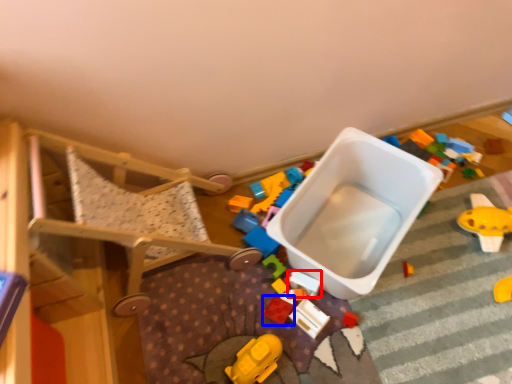
Question: Which point is closer to the camera, toy (highlighted by a red box) or toy (highlighted by a blue box)?

Choices:
 (A) toy
 (B) toy

Answer: (A)